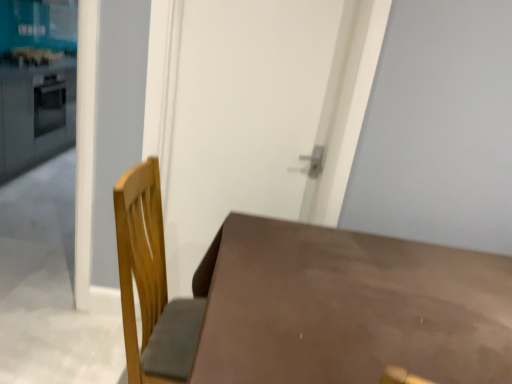
The height and width of the screenshot is (384, 512). Describe the element at coordinates (243, 115) in the screenshot. I see `matte brown door at center` at that location.

Image resolution: width=512 pixels, height=384 pixels. What are the coordinates of `brown matte table at lower left` in the screenshot? It's located at (348, 307).

Visually, is matte white counter top at left, positioned as the second counter top in top-to-bottom order, positioned to the left or to the right of matte brown door at center?

In the image, matte white counter top at left, positioned as the second counter top in top-to-bottom order, appears on the left side of matte brown door at center.

Is point (65, 149) farther from viewer compared to point (172, 270)?

Yes, point (65, 149) is farther from viewer.

Is matte white counter top at left, the first counter top when ordered from bottom to top, positioned in front of matte brown door at center?

No, matte white counter top at left, the first counter top when ordered from bottom to top, is behind matte brown door at center.

From the image's perspective, between matte white counter top at left, the first counter top when ordered from bottom to top, and matte brown door at center, who is located below?

matte brown door at center.

Considering the positions of objects matte white counter top at upper left, which appears as the 1th counter top when viewed from the top, and brown matte table at lower left in the image provided, who is more to the right, matte white counter top at upper left, which appears as the 1th counter top when viewed from the top, or brown matte table at lower left?

brown matte table at lower left is more to the right.

Is matte white counter top at upper left, the 2th counter top in the bottom-to-top sequence, positioned with its back to brown matte table at lower left?

No, brown matte table at lower left is not at the back of matte white counter top at upper left, the 2th counter top in the bottom-to-top sequence.

From their relative heights in the image, would you say matte white counter top at upper left, which appears as the 1th counter top when viewed from the top, is taller or shorter than brown matte table at lower left?

Clearly, matte white counter top at upper left, which appears as the 1th counter top when viewed from the top, is shorter compared to brown matte table at lower left.

From a real-world perspective, is matte white counter top at upper left, which appears as the 1th counter top when viewed from the top, beneath brown matte table at lower left?

Incorrect, from a real-world perspective, matte white counter top at upper left, which appears as the 1th counter top when viewed from the top, is higher than brown matte table at lower left.

Would you say brown matte table at lower left is a long distance from matte white counter top at upper left, the 2th counter top in the bottom-to-top sequence?

Yes, brown matte table at lower left is far from matte white counter top at upper left, the 2th counter top in the bottom-to-top sequence.

In terms of size, does brown matte table at lower left appear bigger or smaller than matte white counter top at upper left, the 2th counter top in the bottom-to-top sequence?

brown matte table at lower left is bigger than matte white counter top at upper left, the 2th counter top in the bottom-to-top sequence.

Which object is closer to the camera taking this photo, brown matte table at lower left or matte white counter top at upper left, the 2th counter top in the bottom-to-top sequence?

brown matte table at lower left is closer to the camera.

From a real-world perspective, is brown matte table at lower left below matte white counter top at upper left, which appears as the 1th counter top when viewed from the top?

Yes.

Are matte brown door at center and matte white counter top at upper left, which appears as the 1th counter top when viewed from the top, beside each other?

No, matte brown door at center is not with matte white counter top at upper left, which appears as the 1th counter top when viewed from the top.

Considering the sizes of objects matte brown door at center and matte white counter top at upper left, which appears as the 1th counter top when viewed from the top, in the image provided, who is smaller, matte brown door at center or matte white counter top at upper left, which appears as the 1th counter top when viewed from the top,?

matte white counter top at upper left, which appears as the 1th counter top when viewed from the top, is smaller.

From the image's perspective, is matte brown door at center above or below matte white counter top at upper left, the 2th counter top in the bottom-to-top sequence?

matte brown door at center is below matte white counter top at upper left, the 2th counter top in the bottom-to-top sequence.

From the image's perspective, is matte white counter top at left, the first counter top when ordered from bottom to top, on brown matte table at lower left?

Correct, matte white counter top at left, the first counter top when ordered from bottom to top, appears higher than brown matte table at lower left in the image.

This screenshot has height=384, width=512. I want to click on counter top that is the 1st one when counting leftward from the brown matte table at lower left, so click(x=36, y=114).

Is matte white counter top at left, positioned as the second counter top in top-to-bottom order, at the right side of brown matte table at lower left?

No.

Are matte white counter top at left, positioned as the second counter top in top-to-bottom order, and brown matte table at lower left located far from each other?

matte white counter top at left, positioned as the second counter top in top-to-bottom order, is positioned a significant distance from brown matte table at lower left.

Considering the relative positions of matte white counter top at upper left, which appears as the 1th counter top when viewed from the top, and matte brown door at center in the image provided, is matte white counter top at upper left, which appears as the 1th counter top when viewed from the top, to the left or to the right of matte brown door at center?

matte white counter top at upper left, which appears as the 1th counter top when viewed from the top, is positioned on matte brown door at center's left side.

Consider the image. Is matte white counter top at upper left, the 2th counter top in the bottom-to-top sequence, with matte brown door at center?

No, matte white counter top at upper left, the 2th counter top in the bottom-to-top sequence, is not next to matte brown door at center.

Which is nearer, (x=35, y=71) or (x=166, y=169)?

Clearly, point (x=35, y=71) is more distant from the camera than point (x=166, y=169).

Can matte brown door at center be found inside matte white counter top at upper left, the 2th counter top in the bottom-to-top sequence?

Definitely not — matte brown door at center is not inside matte white counter top at upper left, the 2th counter top in the bottom-to-top sequence.

In the scene shown: From a real-world perspective, is matte brown door at center beneath brown matte table at lower left?

No, from a real-world perspective, matte brown door at center is not beneath brown matte table at lower left.

Is point (184, 130) positioned after point (345, 358)?

Yes, it is behind point (345, 358).

Is matte brown door at center taller than brown matte table at lower left?

Indeed, matte brown door at center has a greater height compared to brown matte table at lower left.

This screenshot has width=512, height=384. In order to click on the 1st counter top above the matte brown door at center (from the image's perspective) in this screenshot , I will do `click(36, 114)`.

The height and width of the screenshot is (384, 512). Find the location of `table below the matte white counter top at upper left, which appears as the 1th counter top when viewed from the top (from a real-world perspective)`. table below the matte white counter top at upper left, which appears as the 1th counter top when viewed from the top (from a real-world perspective) is located at coordinates (348, 307).

Looking at the image, which one is located further to brown matte table at lower left, matte white counter top at upper left, which appears as the 1th counter top when viewed from the top, or matte white counter top at left, the first counter top when ordered from bottom to top?

matte white counter top at upper left, which appears as the 1th counter top when viewed from the top, is positioned further to the anchor brown matte table at lower left.

When comparing their distances from matte brown door at center, does brown matte table at lower left or matte white counter top at upper left, the 2th counter top in the bottom-to-top sequence, seem closer?

brown matte table at lower left is positioned closer to the anchor matte brown door at center.

Based on their spatial positions, is matte white counter top at upper left, which appears as the 1th counter top when viewed from the top, or matte white counter top at left, the first counter top when ordered from bottom to top, closer to matte brown door at center?

matte white counter top at left, the first counter top when ordered from bottom to top.

From the image, which object appears to be nearer to matte white counter top at left, positioned as the second counter top in top-to-bottom order, matte brown door at center or brown matte table at lower left?

matte brown door at center lies closer to matte white counter top at left, positioned as the second counter top in top-to-bottom order, than the other object.

Based on their spatial positions, is matte white counter top at left, the first counter top when ordered from bottom to top, or brown matte table at lower left further from matte brown door at center?

Based on the image, matte white counter top at left, the first counter top when ordered from bottom to top, appears to be further to matte brown door at center.

From the image, which object appears to be nearer to brown matte table at lower left, matte white counter top at left, the first counter top when ordered from bottom to top, or matte brown door at center?

Among the two, matte brown door at center is located nearer to brown matte table at lower left.

Looking at the image, which one is located closer to matte white counter top at upper left, which appears as the 1th counter top when viewed from the top, brown matte table at lower left or matte white counter top at left, positioned as the second counter top in top-to-bottom order?

matte white counter top at left, positioned as the second counter top in top-to-bottom order, lies closer to matte white counter top at upper left, which appears as the 1th counter top when viewed from the top, than the other object.

Based on their spatial positions, is matte brown door at center or matte white counter top at left, positioned as the second counter top in top-to-bottom order, closer to matte white counter top at upper left, the 2th counter top in the bottom-to-top sequence?

matte white counter top at left, positioned as the second counter top in top-to-bottom order, is positioned closer to the anchor matte white counter top at upper left, the 2th counter top in the bottom-to-top sequence.

Identify the location of screen door positioned between brown matte table at lower left and matte white counter top at upper left, the 2th counter top in the bottom-to-top sequence, from near to far. (243, 115).

The width and height of the screenshot is (512, 384). Find the location of `screen door between brown matte table at lower left and matte white counter top at left, positioned as the second counter top in top-to-bottom order, from front to back`. screen door between brown matte table at lower left and matte white counter top at left, positioned as the second counter top in top-to-bottom order, from front to back is located at coordinates (243, 115).

The height and width of the screenshot is (384, 512). I want to click on counter top positioned between brown matte table at lower left and matte white counter top at upper left, the 2th counter top in the bottom-to-top sequence, from near to far, so click(x=36, y=114).

Find the location of `counter top between matte white counter top at upper left, which appears as the 1th counter top when viewed from the top, and matte brown door at center`. counter top between matte white counter top at upper left, which appears as the 1th counter top when viewed from the top, and matte brown door at center is located at coordinates (36, 114).